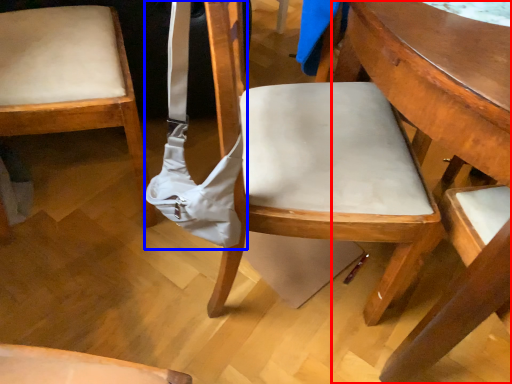
Question: Which of the following is the farthest to the observer, table (highlighted by a red box) or shoulder bag (highlighted by a blue box)?

Choices:
 (A) table
 (B) shoulder bag

Answer: (B)